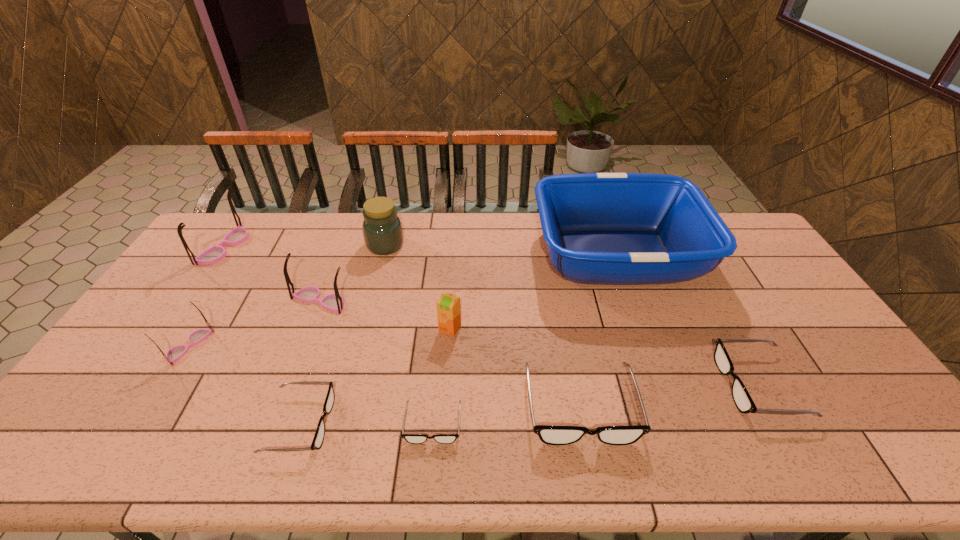
At what (x,y) coordinates should I click in order to perform the action: click on vacant space that's between the orange juice and the second shortest spectacles. Please return your answer as a coordinate pair (x, y). Looking at the image, I should click on (375, 376).

Identify the location of unoccupied area between the biggest black spectacles and the tallest spectacles. (402, 327).

At what (x,y) coordinates should I click in order to perform the action: click on free spot between the orange juice and the third black spectacles from left to right. Please return your answer as a coordinate pair (x, y). The height and width of the screenshot is (540, 960). Looking at the image, I should click on (516, 367).

Identify the location of free space between the second shortest object and the blue tray. (458, 339).

Identify which object is located as the ninth nearest to the eighth tallest object. Please provide its 2D coordinates. Your answer should be formatted as a tuple, i.e. [(x, y)], where the tuple contains the x and y coordinates of a point satisfying the conditions above.

[(214, 254)]

This screenshot has width=960, height=540. I want to click on object that is the third closest one to the fifth shortest object, so click(x=318, y=439).

The width and height of the screenshot is (960, 540). I want to click on spectacles that is the closest to the leftmost black spectacles, so click(x=410, y=438).

Identify the location of the closest spectacles to the orange juice. The image size is (960, 540). (552, 435).

You are a GUI agent. You are given a task and a screenshot of the screen. Output one action in this format:
    pyautogui.click(x=<x>, y=<y>)
    Task: Click on the second closest pink spectacles relative to the shortest object
    The image size is (960, 540).
    Given the screenshot: What is the action you would take?
    pyautogui.click(x=177, y=352)

Identify the location of pink spectacles identified as the closest to the second black spectacles from right to left. This screenshot has width=960, height=540. (334, 302).